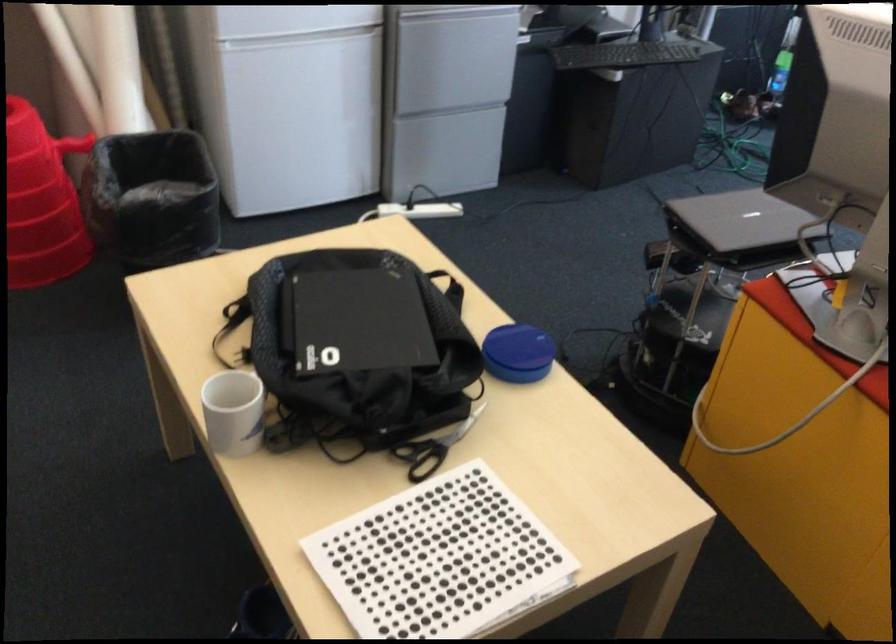
Where would you lift the dotted pattern paper? Please return your answer as a coordinate pair (x, y).

(440, 560)